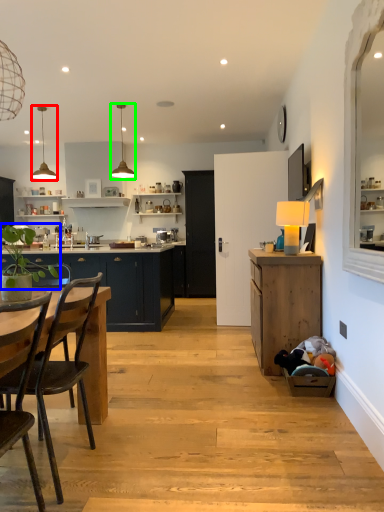
Question: Which object is positioned farthest from lamp (highlighted by a red box)? Select from plant (highlighted by a blue box) and lamp (highlighted by a green box).

Choices:
 (A) plant
 (B) lamp

Answer: (A)